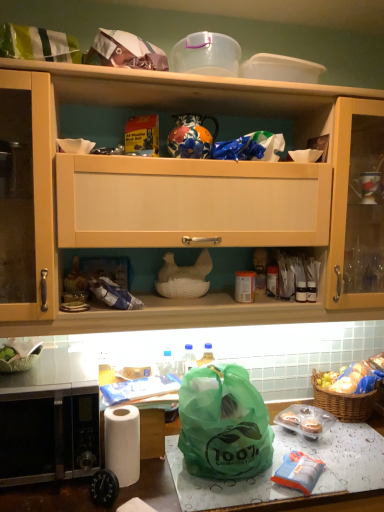
Identify the location of vacant area that lies to the right of translucent plastic bag at lower center, positioned as the 3th food in back-to-front order. The height and width of the screenshot is (512, 384). (345, 471).